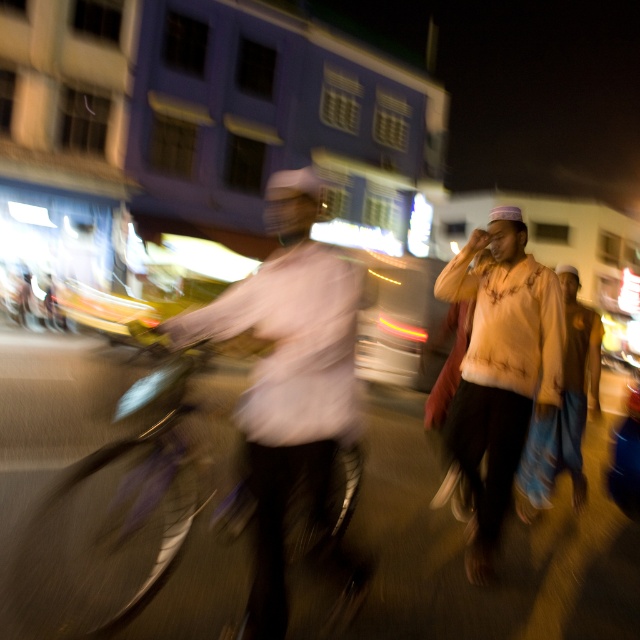
Question: Observing the image, what is the correct spatial positioning of metallic silver bicycle at left in reference to light brown fabric shirt at center?

Choices:
 (A) below
 (B) above

Answer: (A)

Question: Among these points, which one is nearest to the camera?

Choices:
 (A) (484, 276)
 (B) (592, 376)

Answer: (A)

Question: Does metallic silver bicycle at left appear under light brown fabric shirt at center?

Choices:
 (A) yes
 (B) no

Answer: (A)

Question: Estimate the real-world distances between objects in this image. Which object is closer to the light brown fabric shirt at center?

Choices:
 (A) white matte shirt at center
 (B) metallic silver bicycle at left
 (C) light orange cotton shirt at center

Answer: (C)

Question: Which point is closer to the camera?

Choices:
 (A) (x=566, y=288)
 (B) (x=337, y=564)
 (C) (x=449, y=296)
 (D) (x=29, y=580)

Answer: (B)

Question: Where is metallic silver bicycle at left located in relation to light brown fabric shirt at center in the image?

Choices:
 (A) below
 (B) above

Answer: (A)